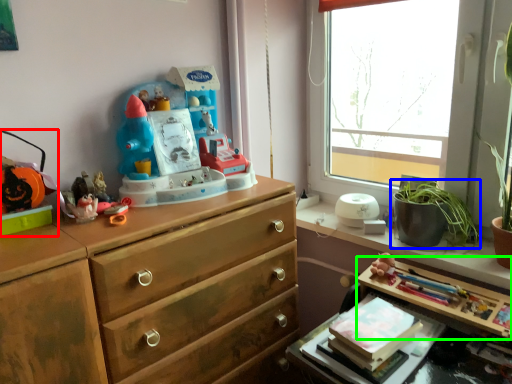
Question: Which object is the farthest from toy (highlighted by a red box)? Choose among these: houseplant (highlighted by a blue box) or table (highlighted by a green box).

Choices:
 (A) houseplant
 (B) table

Answer: (A)